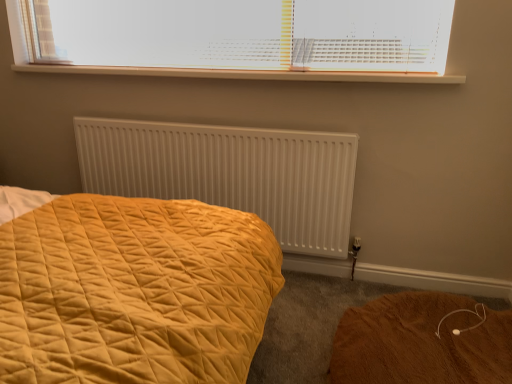
Question: Relative to white matte radiator at center, is white plastic blinds at upper center in front or behind?

Choices:
 (A) front
 (B) behind

Answer: (A)

Question: In terms of height, does white plastic blinds at upper center look taller or shorter compared to white matte radiator at center?

Choices:
 (A) short
 (B) tall

Answer: (A)

Question: Which object is the farthest from the white plastic blinds at upper center?

Choices:
 (A) white plastic radiator at upper center
 (B) white matte radiator at center
 (C) brown fuzzy rug at lower right

Answer: (C)

Question: Which object is the farthest from the white plastic radiator at upper center?

Choices:
 (A) white matte radiator at center
 (B) brown fuzzy rug at lower right
 (C) white plastic blinds at upper center

Answer: (B)